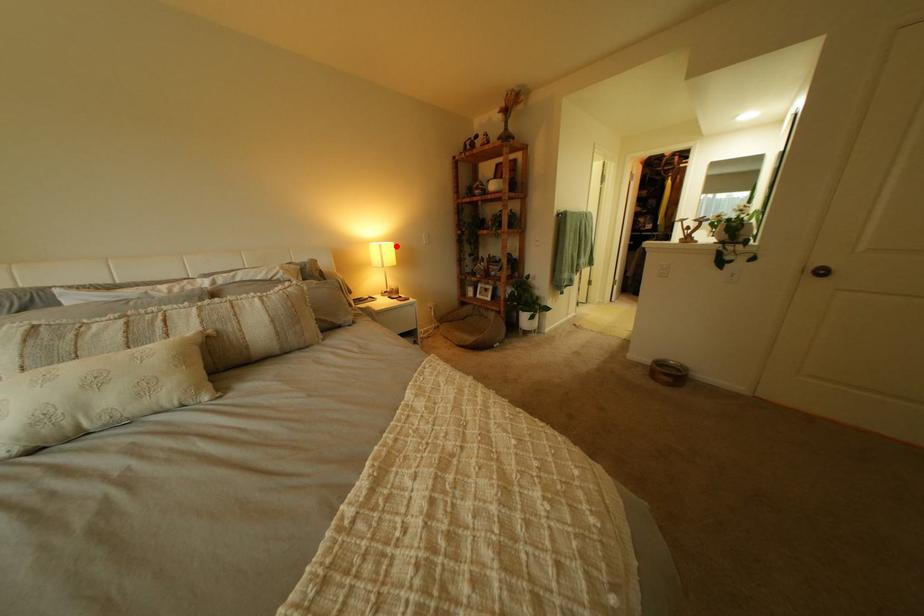
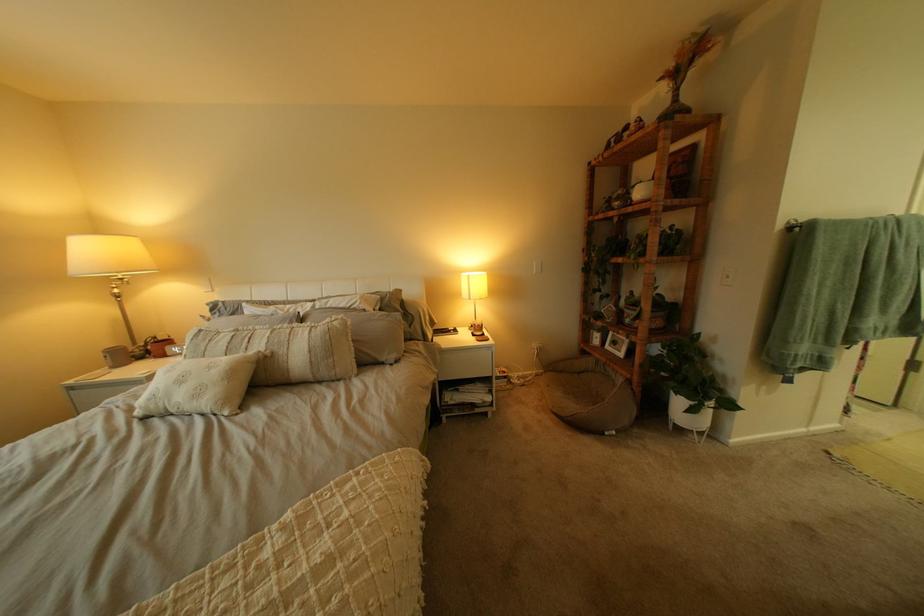
Where in the second image is the point corresponding to the highlighted location from the first image?

(483, 277)